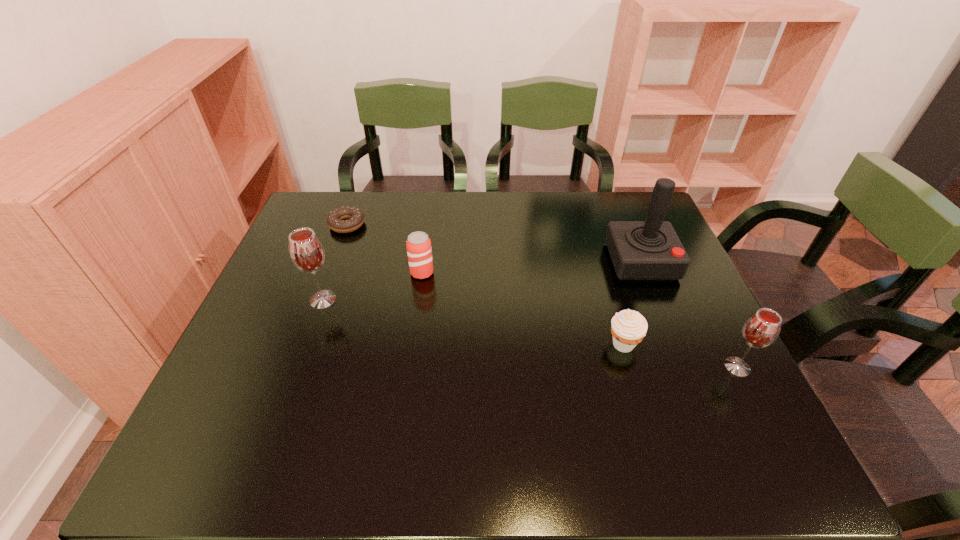
Please point a spot to place another wineglass for symmetrical spacing. Please provide its 2D coordinates. Your answer should be formatted as a tuple, i.e. [(x, y)], where the tuple contains the x and y coordinates of a point satisfying the conditions above.

[(516, 331)]